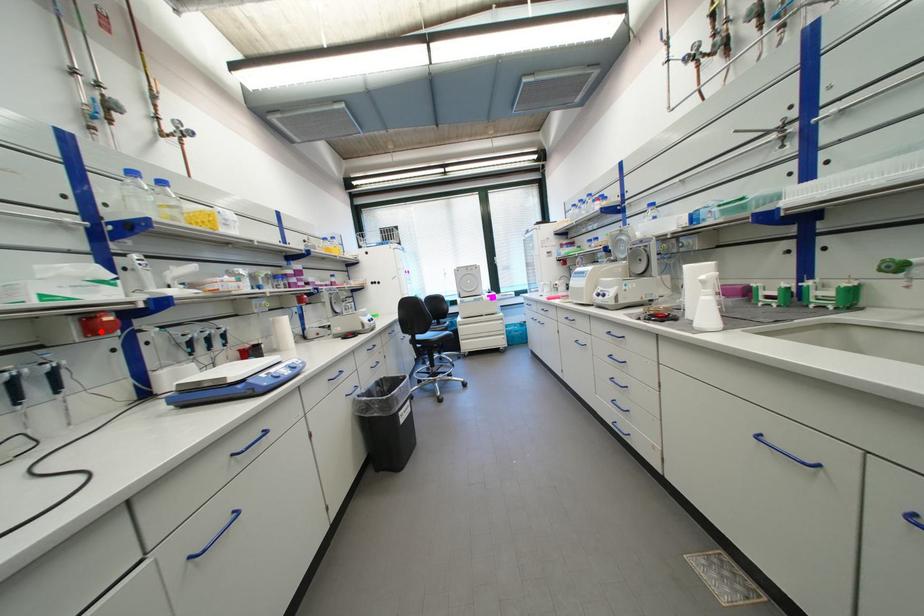
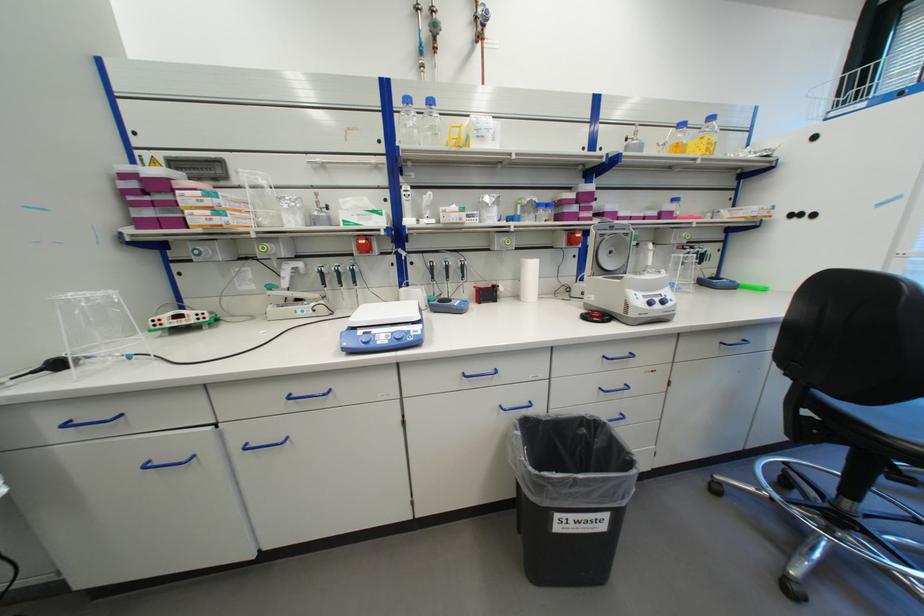
Find the pixel in the second image that matches the highlighted location in the first image.

(373, 249)